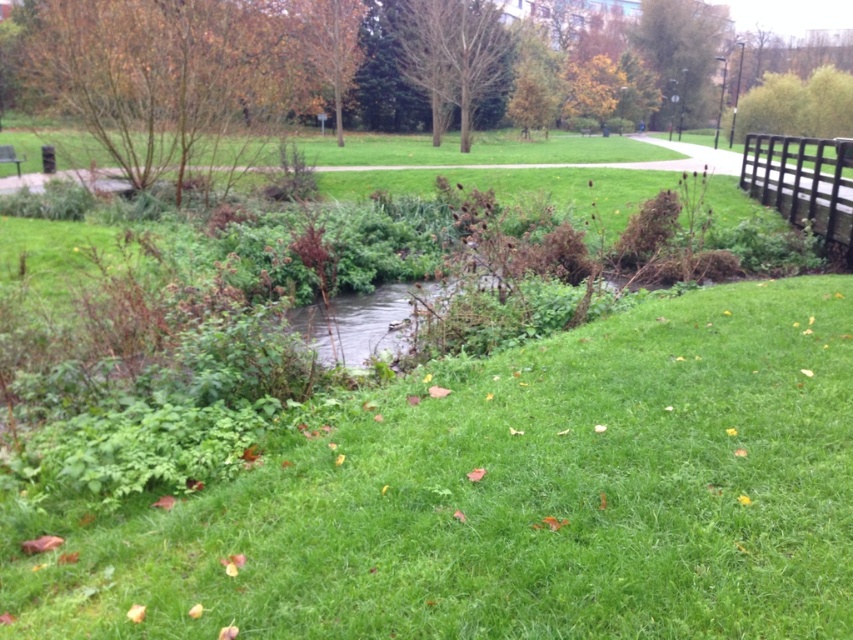
Question: Which point is closer to the camera?

Choices:
 (A) bare wood tree at center
 (B) green leafy tree at upper center
 (C) brown leafy tree at upper left
 (D) brown wooden fence at upper right

Answer: (D)

Question: Which point is closer to the camera taking this photo?

Choices:
 (A) (491, 19)
 (B) (718, 38)
 (C) (830, 234)

Answer: (C)

Question: Does bare wood tree at center have a larger size compared to brown wooden fence at upper right?

Choices:
 (A) yes
 (B) no

Answer: (A)

Question: Among these points, which one is farthest from the camera?

Choices:
 (A) (648, 24)
 (B) (830, 161)
 (C) (256, 36)
 (D) (430, 49)

Answer: (A)

Question: Where is brown leafy tree at upper left located in relation to brown wooden fence at upper right in the image?

Choices:
 (A) right
 (B) left

Answer: (B)

Question: Is brown leafy tree at upper left bigger than brown wooden fence at upper right?

Choices:
 (A) yes
 (B) no

Answer: (A)